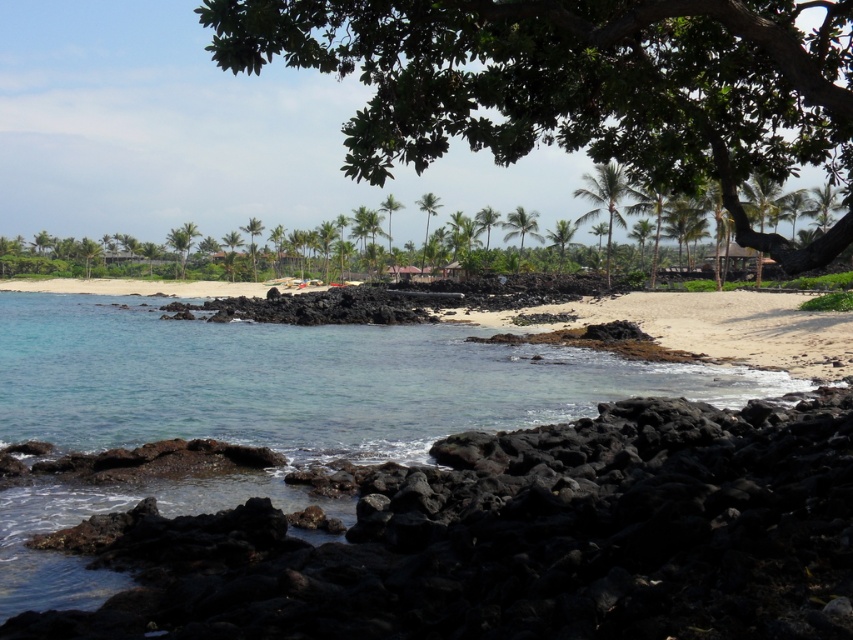
You are a hiker who has just arrived at the beach and wants to reach the green leafy palm tree at center from your current position near the black volcanic rock at lower left. Given that your average walking speed is 1.5 meters per second, how many seconds will it take you to walk directly to the palm tree?

The distance between the black volcanic rock at lower left and the green leafy palm tree at center is 56.36 meters. At a speed of 1.5 meters per second, the time required is 56.36 divided by 1.5, which equals approximately 37.57 seconds. Therefore, it will take about 38 seconds to reach the palm tree.

You are standing at the edge of the rocky shoreline and want to walk to the white sandy beach at lower right. Which direction should you move relative to the black volcanic rock at lower left?

You should move away from the black volcanic rock at lower left towards the white sandy beach at lower right since the black volcanic rock is closer to you and the sandy beach is further away.